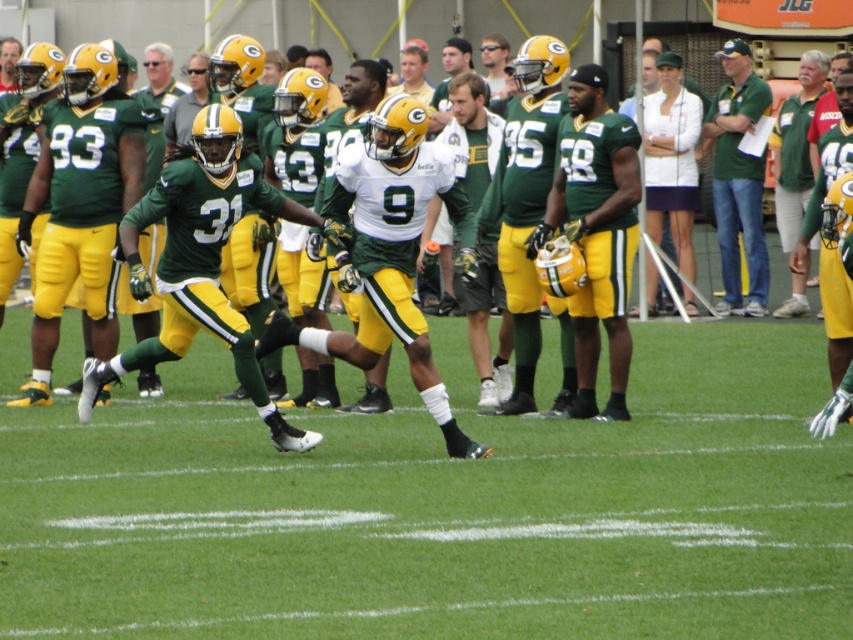
Consider the image. You are a coach observing the practice session. You notice the green matte shirt at upper right and the matte green helmet at upper center. Which object is positioned farther to the right side of the image?

The green matte shirt at upper right is positioned farther to the right side of the image than the matte green helmet at upper center.

You are a coach observing the practice session. You notice two items in the upper part of the field. One is a green matte shirt at upper right and the other is a matte green helmet at upper center. Which item is located lower on the field?

The green matte shirt at upper right is positioned under matte green helmet at upper center, so the green matte shirt at upper right is lower on the field.

You are a sports analyst observing the football practice. You notice two items at the center of the field labeled as the matte green jersey at center and the matte green uniform at center. Which item is covering the other?

The matte green jersey at center is positioned over the matte green uniform at center, so the jersey is covering the uniform.